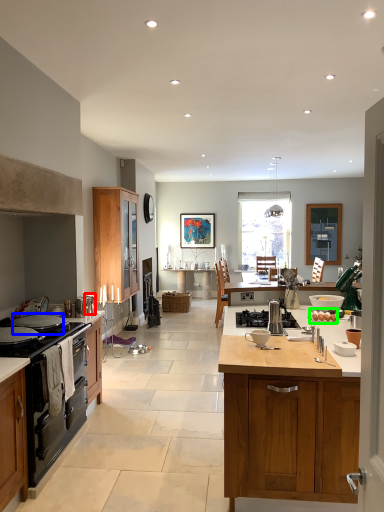
Question: Which is farther away from appliance (highlighted by a red box)? appliance (highlighted by a blue box) or food (highlighted by a green box)?

Choices:
 (A) appliance
 (B) food

Answer: (B)